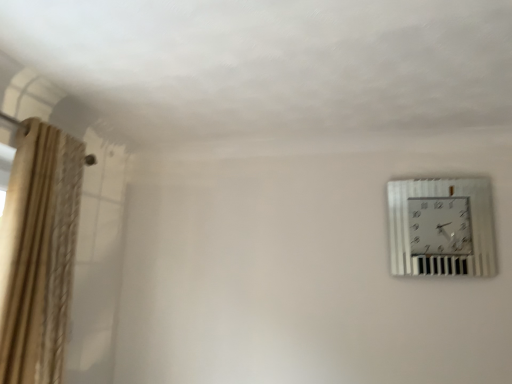
What is the approximate width of beige textured curtain at left?

The width of beige textured curtain at left is 13.40 inches.

The image size is (512, 384). Describe the element at coordinates (38, 253) in the screenshot. I see `beige textured curtain at left` at that location.

Locate an element on the screen. This screenshot has height=384, width=512. beige textured curtain at left is located at coordinates (x=38, y=253).

The image size is (512, 384). What do you see at coordinates (441, 227) in the screenshot?
I see `metallic silver wall clock at upper right` at bounding box center [441, 227].

Where is `metallic silver wall clock at upper right`? This screenshot has width=512, height=384. metallic silver wall clock at upper right is located at coordinates (441, 227).

I want to click on beige textured curtain at left, so click(x=38, y=253).

Can you confirm if beige textured curtain at left is positioned to the left of metallic silver wall clock at upper right?

Correct, you'll find beige textured curtain at left to the left of metallic silver wall clock at upper right.

Is the position of beige textured curtain at left more distant than that of metallic silver wall clock at upper right?

No, beige textured curtain at left is closer to the viewer.

Which is behind, point (25, 316) or point (397, 185)?

The point (397, 185) is farther.

From the image's perspective, does beige textured curtain at left appear higher than metallic silver wall clock at upper right?

Incorrect, from the image's perspective, beige textured curtain at left is lower than metallic silver wall clock at upper right.

From a real-world perspective, which object rests below the other?

From a 3D spatial view, beige textured curtain at left is below.

Can you confirm if beige textured curtain at left is thinner than metallic silver wall clock at upper right?

No.

Can you confirm if beige textured curtain at left is shorter than metallic silver wall clock at upper right?

No.

Can you confirm if beige textured curtain at left is smaller than metallic silver wall clock at upper right?

No, beige textured curtain at left is not smaller than metallic silver wall clock at upper right.

Would you say beige textured curtain at left is outside metallic silver wall clock at upper right?

Yes, beige textured curtain at left is not within metallic silver wall clock at upper right.

Is beige textured curtain at left beside metallic silver wall clock at upper right?

No, beige textured curtain at left is not making contact with metallic silver wall clock at upper right.

Is beige textured curtain at left facing towards metallic silver wall clock at upper right?

No, beige textured curtain at left does not turn towards metallic silver wall clock at upper right.

The width and height of the screenshot is (512, 384). What are the coordinates of `wall clock on the right of beige textured curtain at left` in the screenshot? It's located at (441, 227).

Does metallic silver wall clock at upper right appear on the left side of beige textured curtain at left?

No, metallic silver wall clock at upper right is not to the left of beige textured curtain at left.

Which is in front, metallic silver wall clock at upper right or beige textured curtain at left?

beige textured curtain at left is more forward.

Is point (470, 238) closer to camera compared to point (64, 318)?

No, it is behind (64, 318).

From the image's perspective, is metallic silver wall clock at upper right located beneath beige textured curtain at left?

No, from the image's perspective, metallic silver wall clock at upper right is not below beige textured curtain at left.

From a real-world perspective, is metallic silver wall clock at upper right positioned above or below beige textured curtain at left?

In terms of real-world spatial position, metallic silver wall clock at upper right is above beige textured curtain at left.

Is metallic silver wall clock at upper right thinner than beige textured curtain at left?

Yes.

Does metallic silver wall clock at upper right have a lesser height compared to beige textured curtain at left?

Yes, metallic silver wall clock at upper right is shorter than beige textured curtain at left.

Who is bigger, metallic silver wall clock at upper right or beige textured curtain at left?

With larger size is beige textured curtain at left.

Could beige textured curtain at left be considered to be inside metallic silver wall clock at upper right?

No, metallic silver wall clock at upper right does not contain beige textured curtain at left.

Is metallic silver wall clock at upper right far away from beige textured curtain at left?

Yes.

Is metallic silver wall clock at upper right turned away from beige textured curtain at left?

That's not correct — metallic silver wall clock at upper right is not looking away from beige textured curtain at left.

Can you tell me how much metallic silver wall clock at upper right and beige textured curtain at left differ in facing direction?

87.9 degrees separate the facing orientations of metallic silver wall clock at upper right and beige textured curtain at left.

Where is `wall clock above the beige textured curtain at left (from a real-world perspective)`? wall clock above the beige textured curtain at left (from a real-world perspective) is located at coordinates pos(441,227).

I want to click on wall clock above the beige textured curtain at left (from the image's perspective), so click(441, 227).

Locate an element on the screen. The width and height of the screenshot is (512, 384). wall clock on the right of beige textured curtain at left is located at coordinates (441, 227).